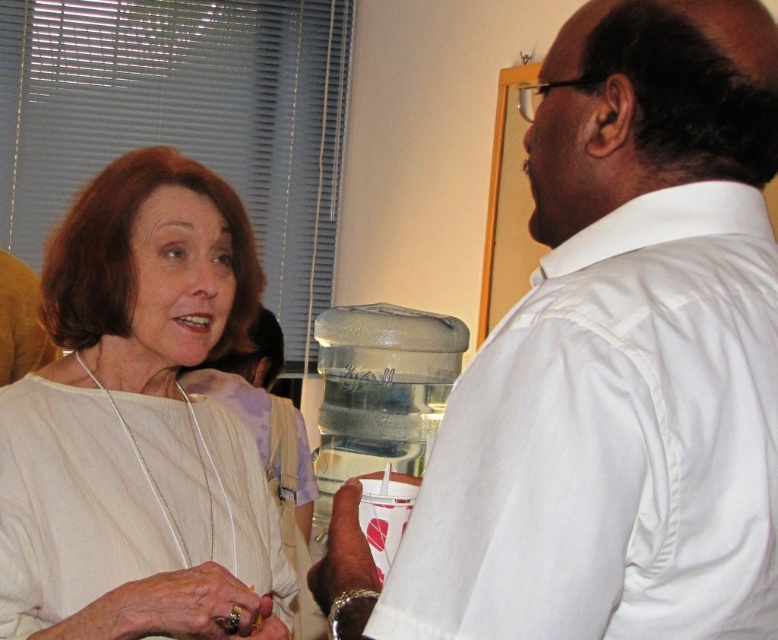
You are observing two people in a break room. You notice the brown leather wristband at lower center and the gold metallic ring at lower left. Which of these items is positioned higher on the person wearing them?

The brown leather wristband at lower center is located above the gold metallic ring at lower left, so it is positioned higher on the person wearing them.

In the scene shown: You are standing in a break room and see a point at coordinates [135,413]. Which object does this point belong to?

The point at coordinates [135,413] belongs to the white matte necklace at upper left.